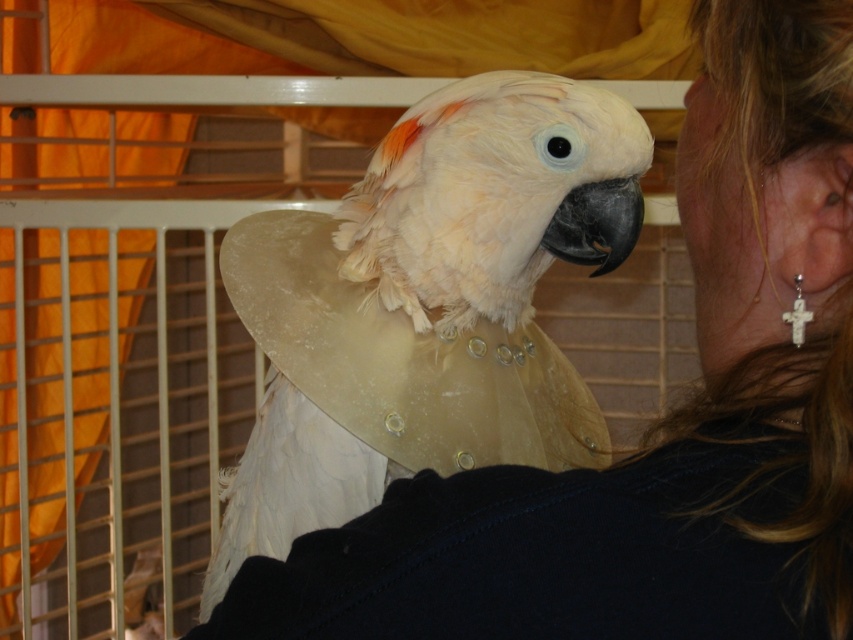
Consider the image. You are a wildlife photographer trying to capture a close shot of the white feathered parrot at center and the black glossy beak at center. Which object should you focus on first if you want to photograph the larger one?

The white feathered parrot at center is bigger than the black glossy beak at center, so you should focus on the white feathered parrot at center first.

You are a jeweler examining two white crosses in the image. The first is the white cross earring at right, and the second is the white ceramic cross at ear. Which of these crosses is positioned more to the left?

The white cross earring at right is positioned more to the left than the white ceramic cross at ear.